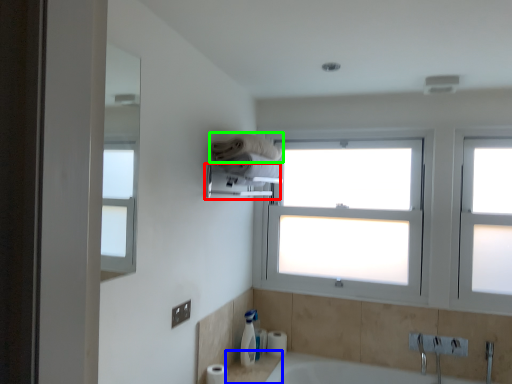
Question: Based on their relative distances, which object is nearer to towel bar (highlighted by a red box)? Choose from counter top (highlighted by a blue box) and towel (highlighted by a green box).

Choices:
 (A) counter top
 (B) towel

Answer: (B)